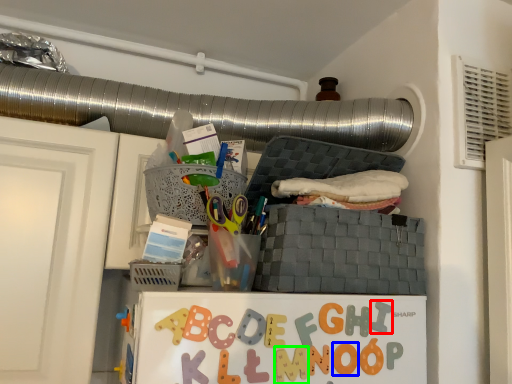
Question: Based on their relative distances, which object is farther from alphabet (highlighted by a red box)? Choose from letter (highlighted by a blue box) and alphabet (highlighted by a green box).

Choices:
 (A) letter
 (B) alphabet

Answer: (B)